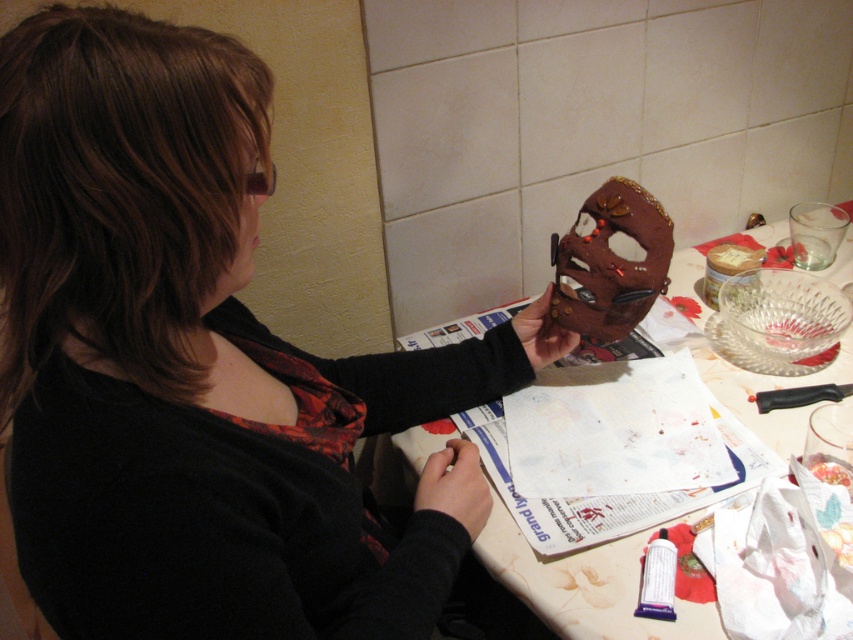
You are an artist who wants to place a new decorative item on the table. You see the matte brown mask at upper right and the matte brown mask at center. Which mask is positioned lower on the table?

The matte brown mask at upper right is located below the matte brown mask at center, so it is positioned lower on the table.

Based on the photo, you are a craftsperson who needs to place the matte brown mask at upper right onto a shelf that is 18 inches away from your current position. Can you reach it without moving your body?

The matte brown mask at upper right is 19.04 inches away from the viewer, which is slightly farther than the shelf distance of 18 inches. Therefore, you cannot reach it without moving your body.

You are a craft assistant standing at the table. You need to retrieve two points marked on the table for alignment. The points are labeled as point (x=442, y=362) and point (x=589, y=627). Which point should you reach for first if you want to start from the one closer to you?

Point (x=589, y=627) is closer to you than point (x=442, y=362), so you should reach for point (x=589, y=627) first.